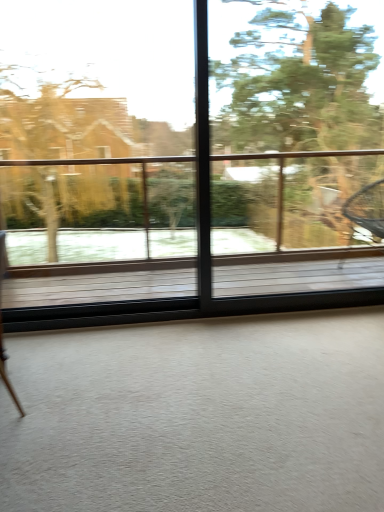
Question: Is transparent glass window at center in front of or behind green leafy tree at upper right in the image?

Choices:
 (A) front
 (B) behind

Answer: (A)

Question: Considering the positions of transparent glass window at center and green leafy tree at upper right in the image, is transparent glass window at center wider or thinner than green leafy tree at upper right?

Choices:
 (A) wide
 (B) thin

Answer: (B)

Question: From their relative heights in the image, would you say transparent glass window at center is taller or shorter than green leafy tree at upper right?

Choices:
 (A) tall
 (B) short

Answer: (A)

Question: Is point (301, 75) closer or farther from the camera than point (43, 311)?

Choices:
 (A) closer
 (B) farther

Answer: (B)

Question: In terms of height, does green leafy tree at upper right look taller or shorter compared to transparent glass window at center?

Choices:
 (A) tall
 (B) short

Answer: (B)

Question: Is green leafy tree at upper right bigger or smaller than transparent glass window at center?

Choices:
 (A) small
 (B) big

Answer: (B)

Question: Considering the relative positions of green leafy tree at upper right and transparent glass window at center in the image provided, is green leafy tree at upper right to the left or to the right of transparent glass window at center?

Choices:
 (A) left
 (B) right

Answer: (B)